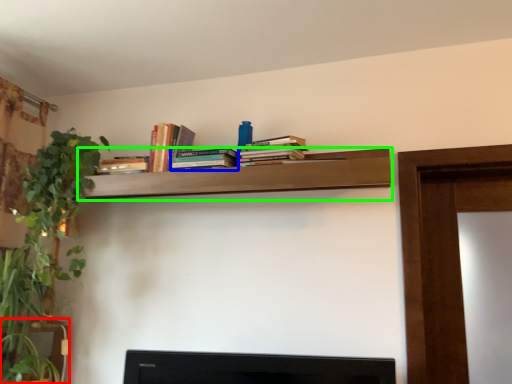
Question: Estimate the real-world distances between objects in this image. Which object is closer to furniture (highlighted by a red box), book (highlighted by a blue box) or shelf (highlighted by a green box)?

Choices:
 (A) book
 (B) shelf

Answer: (B)